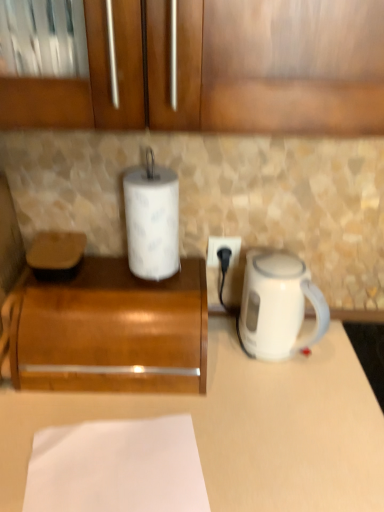
Where is `empty space that is ontop of white matte counter at center`? This screenshot has height=512, width=384. empty space that is ontop of white matte counter at center is located at coordinates (245, 400).